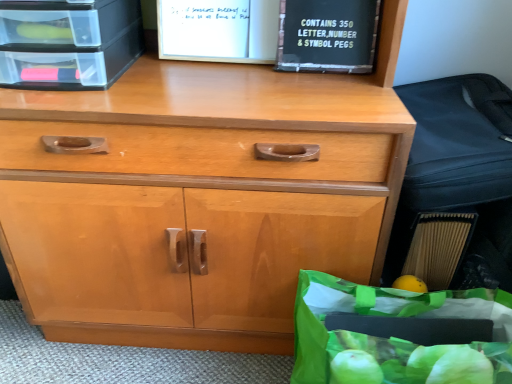
What do you see at coordinates (68, 43) in the screenshot?
I see `clear plastic crate at upper left` at bounding box center [68, 43].

In order to click on green plastic bag at lower right in this screenshot , I will do `click(399, 334)`.

From the image's perspective, is green plastic bag at lower right on black plastic sign at upper right?

No, from the image's perspective, green plastic bag at lower right is not over black plastic sign at upper right.

Considering the sizes of objects green plastic bag at lower right and black plastic sign at upper right in the image provided, who is taller, green plastic bag at lower right or black plastic sign at upper right?

green plastic bag at lower right is taller.

Is green plastic bag at lower right smaller than black plastic sign at upper right?

Incorrect, green plastic bag at lower right is not smaller in size than black plastic sign at upper right.

Looking at this image, from a real-world perspective, is green plastic bag at lower right on top of black plastic sign at upper right?

Actually, green plastic bag at lower right is physically below black plastic sign at upper right in the real world.

Visually, is black plastic book at upper center positioned to the left or to the right of black plastic sign at upper right?

Clearly, black plastic book at upper center is on the left of black plastic sign at upper right in the image.

Which object is more forward, black plastic book at upper center or black plastic sign at upper right?

black plastic sign at upper right is more forward.

From a real-world perspective, is black plastic book at upper center located higher than black plastic sign at upper right?

No, from a real-world perspective, black plastic book at upper center is not on top of black plastic sign at upper right.

What's the angular difference between black plastic book at upper center and black plastic sign at upper right's facing directions?

black plastic book at upper center and black plastic sign at upper right are facing 0.621 degrees away from each other.

Consider the image. What's the angular difference between green plastic bag at lower right and clear plastic crate at upper left's facing directions?

The angular difference between green plastic bag at lower right and clear plastic crate at upper left is 1.25 degrees.

Consider the image. In the image, is green plastic bag at lower right positioned in front of or behind clear plastic crate at upper left?

In the image, green plastic bag at lower right appears in front of clear plastic crate at upper left.

Choose the correct answer: Is green plastic bag at lower right inside clear plastic crate at upper left or outside it?

The correct answer is: outside.

Can you confirm if green plastic bag at lower right is smaller than clear plastic crate at upper left?

Incorrect, green plastic bag at lower right is not smaller in size than clear plastic crate at upper left.

Are black plastic sign at upper right and clear plastic crate at upper left far apart?

black plastic sign at upper right is near clear plastic crate at upper left, not far away.

Does black plastic sign at upper right have a lesser height compared to clear plastic crate at upper left?

Yes, black plastic sign at upper right is shorter than clear plastic crate at upper left.

Who is more distant, black plastic sign at upper right or clear plastic crate at upper left?

black plastic sign at upper right is more distant.

This screenshot has width=512, height=384. I want to click on book lying on the right of clear plastic crate at upper left, so click(x=279, y=34).

Is black plastic book at upper center facing away from clear plastic crate at upper left?

That's not correct — black plastic book at upper center is not looking away from clear plastic crate at upper left.

In terms of width, does black plastic book at upper center look wider or thinner when compared to clear plastic crate at upper left?

Clearly, black plastic book at upper center has less width compared to clear plastic crate at upper left.

Would you say black plastic sign at upper right is outside green plastic bag at lower right?

black plastic sign at upper right is positioned outside green plastic bag at lower right.

How many degrees apart are the facing directions of black plastic sign at upper right and green plastic bag at lower right?

0.837 degrees.

Which object is closer to the camera, black plastic sign at upper right or green plastic bag at lower right?

Positioned in front is green plastic bag at lower right.

Does black plastic sign at upper right appear on the left side of green plastic bag at lower right?

Yes.

Is clear plastic crate at upper left facing towards black plastic book at upper center?

No.

Can you tell me how much clear plastic crate at upper left and black plastic book at upper center differ in facing direction?

The angular difference between clear plastic crate at upper left and black plastic book at upper center is 0.211 degrees.

Considering the relative sizes of clear plastic crate at upper left and black plastic book at upper center in the image provided, is clear plastic crate at upper left shorter than black plastic book at upper center?

In fact, clear plastic crate at upper left may be taller than black plastic book at upper center.

From the image's perspective, does clear plastic crate at upper left appear higher than black plastic book at upper center?

Incorrect, from the image's perspective, clear plastic crate at upper left is lower than black plastic book at upper center.

Where is `paperback book that appears on the left of green plastic bag at lower right`? The width and height of the screenshot is (512, 384). paperback book that appears on the left of green plastic bag at lower right is located at coordinates (327, 35).

Find the location of a particular element. book below the black plastic sign at upper right (from a real-world perspective) is located at coordinates (279, 34).

Considering their positions, is black plastic sign at upper right positioned further to clear plastic crate at upper left than black plastic book at upper center?

black plastic sign at upper right lies further to clear plastic crate at upper left than the other object.

Based on their spatial positions, is clear plastic crate at upper left or black plastic book at upper center further from green plastic bag at lower right?

clear plastic crate at upper left is positioned further to the anchor green plastic bag at lower right.

Which object lies further to the anchor point black plastic book at upper center, clear plastic crate at upper left or black plastic sign at upper right?

The object further to black plastic book at upper center is clear plastic crate at upper left.

Based on their spatial positions, is black plastic sign at upper right or clear plastic crate at upper left further from green plastic bag at lower right?

Based on the image, clear plastic crate at upper left appears to be further to green plastic bag at lower right.

Looking at the image, which one is located closer to green plastic bag at lower right, black plastic book at upper center or clear plastic crate at upper left?

black plastic book at upper center is closer to green plastic bag at lower right.

When comparing their distances from black plastic book at upper center, does green plastic bag at lower right or clear plastic crate at upper left seem further?

green plastic bag at lower right is positioned further to the anchor black plastic book at upper center.

Estimate the real-world distances between objects in this image. Which object is closer to black plastic book at upper center, clear plastic crate at upper left or green plastic bag at lower right?

clear plastic crate at upper left is positioned closer to the anchor black plastic book at upper center.

Based on their spatial positions, is black plastic book at upper center or green plastic bag at lower right further from black plastic sign at upper right?

green plastic bag at lower right is further to black plastic sign at upper right.

This screenshot has height=384, width=512. What are the coordinates of `paperback book between black plastic book at upper center and green plastic bag at lower right vertically` in the screenshot? It's located at (327, 35).

The height and width of the screenshot is (384, 512). Find the location of `crate that lies between black plastic sign at upper right and green plastic bag at lower right from top to bottom`. crate that lies between black plastic sign at upper right and green plastic bag at lower right from top to bottom is located at coordinates (68, 43).

The width and height of the screenshot is (512, 384). Identify the location of crate between black plastic book at upper center and green plastic bag at lower right in the vertical direction. (68, 43).

Locate an element on the screen. book located between clear plastic crate at upper left and black plastic sign at upper right in the left-right direction is located at coordinates (279, 34).